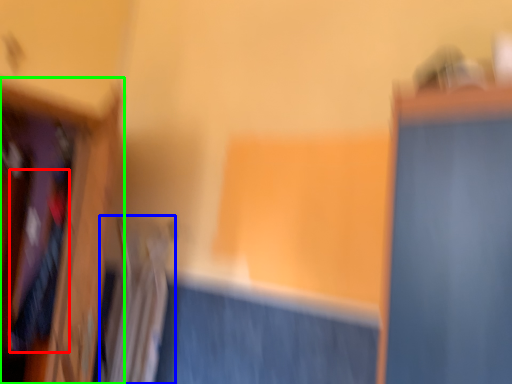
Question: Based on their relative distances, which object is nearer to clothing (highlighted by a red box)? Choose from radiator (highlighted by a blue box) and furniture (highlighted by a green box).

Choices:
 (A) radiator
 (B) furniture

Answer: (B)